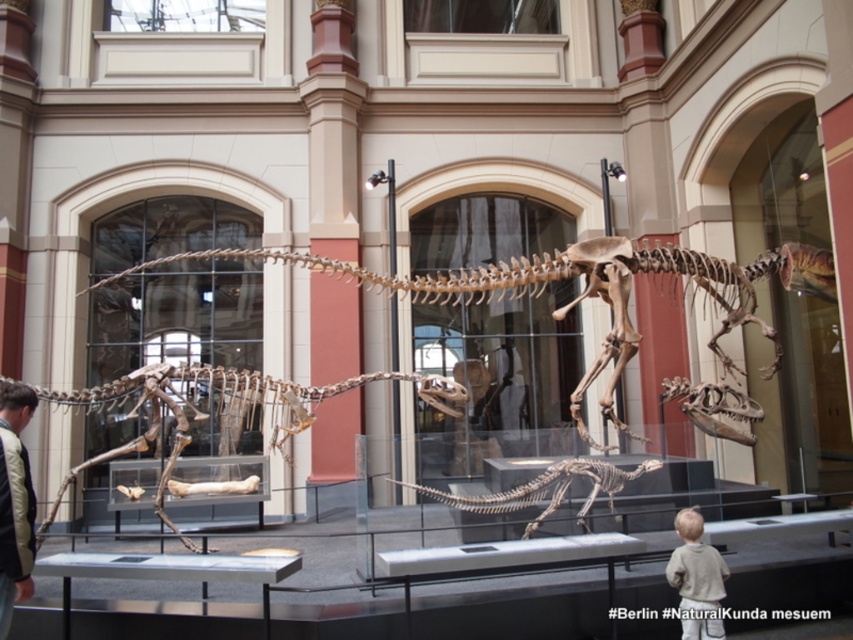
Who is higher up, khaki fabric jacket at left or brown bone-like skeleton at center?

khaki fabric jacket at left is higher up.

Can you confirm if khaki fabric jacket at left is positioned above brown bone-like skeleton at center?

Yes, khaki fabric jacket at left is above brown bone-like skeleton at center.

I want to click on khaki fabric jacket at left, so click(15, 500).

Does khaki fabric jacket at left appear on the left side of light gray sweater at lower right?

Correct, you'll find khaki fabric jacket at left to the left of light gray sweater at lower right.

Does khaki fabric jacket at left appear over light gray sweater at lower right?

Yes.

At what (x,y) coordinates should I click in order to perform the action: click on khaki fabric jacket at left. Please return your answer as a coordinate pair (x, y). The image size is (853, 640). Looking at the image, I should click on (15, 500).

Is brown bone dinosaur at center positioned before light gray sweater at lower right?

No.

Where is `brown bone dinosaur at center`? The width and height of the screenshot is (853, 640). brown bone dinosaur at center is located at coordinates (219, 406).

Is point (160, 390) farther from viewer compared to point (693, 564)?

Yes, point (160, 390) is behind point (693, 564).

Identify the location of brown bone dinosaur at center. This screenshot has width=853, height=640. [x=219, y=406].